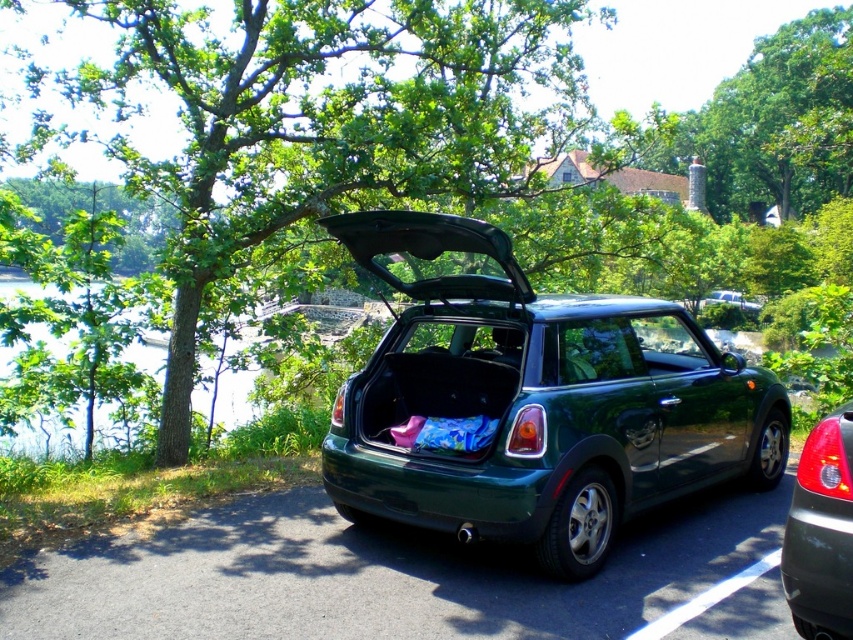
Question: Among these objects, which one is farthest from the camera?

Choices:
 (A) green leafy tree at upper left
 (B) green matte car trunk at center
 (C) green matte car at center

Answer: (A)

Question: Does green leafy tree at upper left appear under green matte car trunk at center?

Choices:
 (A) no
 (B) yes

Answer: (A)

Question: From the image, what is the correct spatial relationship of green matte car trunk at center in relation to green matte car at center?

Choices:
 (A) left
 (B) right

Answer: (A)

Question: Estimate the real-world distances between objects in this image. Which object is farther from the green leafy tree at upper left?

Choices:
 (A) green matte car at center
 (B) green matte car trunk at center

Answer: (A)

Question: Among these objects, which one is nearest to the camera?

Choices:
 (A) green matte car trunk at center
 (B) green leafy tree at upper left
 (C) green water at left
 (D) green matte car at center

Answer: (D)

Question: Is green matte car at center smaller than green water at left?

Choices:
 (A) yes
 (B) no

Answer: (A)